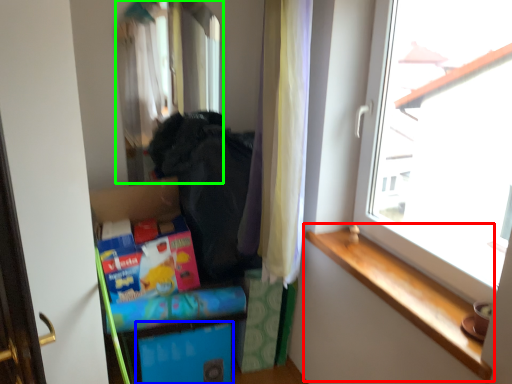
Question: Which object is the farthest from window sill (highlighted by a red box)? Choose among these: storage box (highlighted by a blue box) or mirror (highlighted by a green box).

Choices:
 (A) storage box
 (B) mirror

Answer: (B)